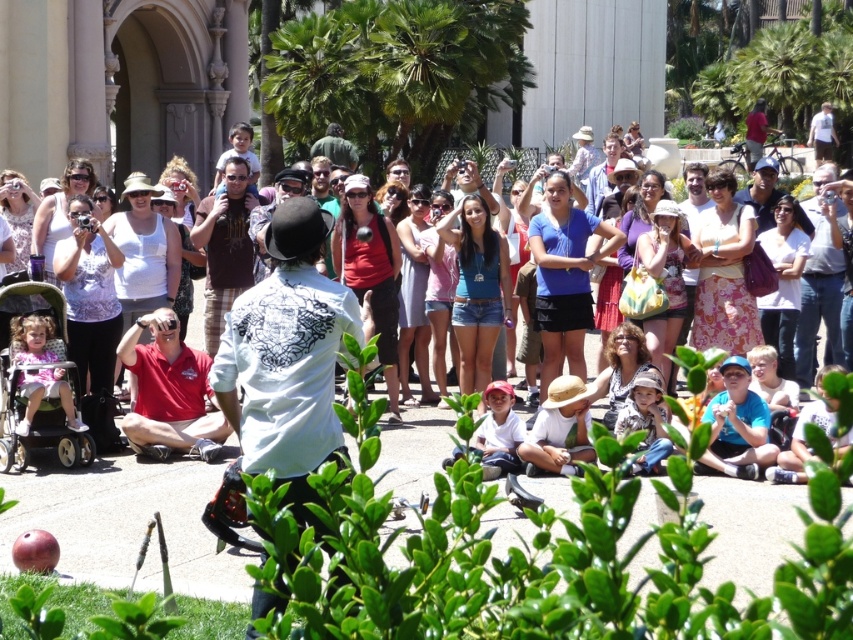
Looking at this image, can you confirm if black plastic baby carriage at lower left is bigger than green fabric hat at center?

Indeed, black plastic baby carriage at lower left has a larger size compared to green fabric hat at center.

Between black plastic baby carriage at lower left and green fabric hat at center, which one has more height?

black plastic baby carriage at lower left is taller.

Is point (3, 298) positioned in front of point (312, 156)?

Yes, point (3, 298) is in front of point (312, 156).

Identify the location of black plastic baby carriage at lower left. The height and width of the screenshot is (640, 853). point(44,396).

At what (x,y) coordinates should I click in order to perform the action: click on black plastic baby carriage at lower left. Please return your answer as a coordinate pair (x, y). The image size is (853, 640). Looking at the image, I should click on (44, 396).

Does black plastic baby carriage at lower left appear under matte black hat at upper center?

Indeed, black plastic baby carriage at lower left is positioned under matte black hat at upper center.

Describe the element at coordinates (44, 396) in the screenshot. I see `black plastic baby carriage at lower left` at that location.

The width and height of the screenshot is (853, 640). Find the location of `black plastic baby carriage at lower left`. black plastic baby carriage at lower left is located at coordinates (44, 396).

Who is more forward, (231, 147) or (317, 147)?

Positioned in front is point (317, 147).

Where is `matte black hat at upper center`? matte black hat at upper center is located at coordinates (238, 150).

At what (x,y) coordinates should I click in order to perform the action: click on matte black hat at upper center. Please return your answer as a coordinate pair (x, y). This screenshot has width=853, height=640. Looking at the image, I should click on (238, 150).